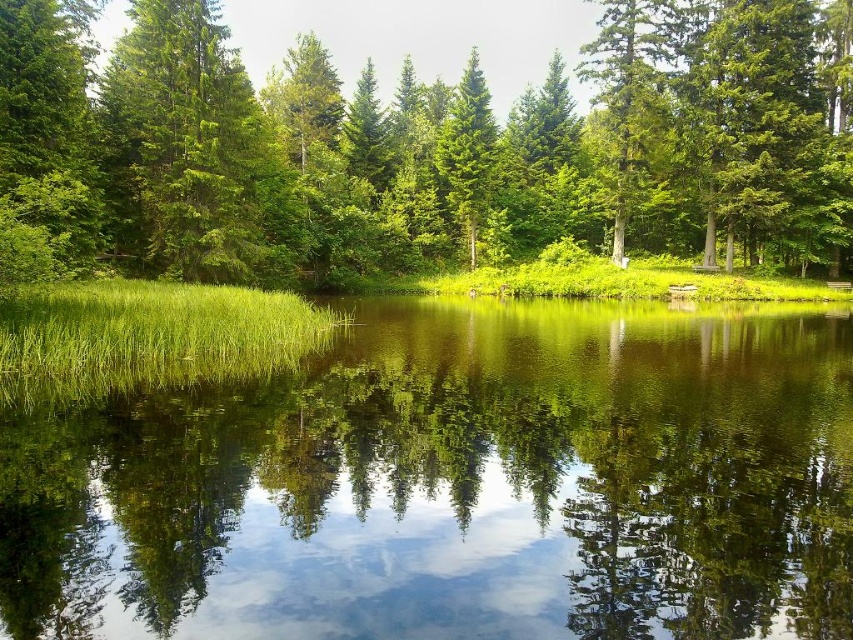
Identify the location of green grassy lake at center. Image resolution: width=853 pixels, height=640 pixels. [x=456, y=484].

Between green grassy lake at center and green matte tree at center, which one has less height?

With less height is green grassy lake at center.

Does point (267, 426) come closer to viewer compared to point (462, 170)?

Yes, it is in front of point (462, 170).

Find the location of a particular element. green grassy lake at center is located at coordinates (456, 484).

Is point (213, 22) behind point (467, 209)?

That is False.

Does green leafy tree at center appear on the left side of green matte tree at center?

Indeed, green leafy tree at center is positioned on the left side of green matte tree at center.

At what (x,y) coordinates should I click in order to perform the action: click on green leafy tree at center. Please return your answer as a coordinate pair (x, y). The height and width of the screenshot is (640, 853). Looking at the image, I should click on (421, 148).

Is the position of green leafy tree at center less distant than that of green matte tree at left?

Yes, green leafy tree at center is closer to the viewer.

Which is more to the right, green leafy tree at center or green matte tree at left?

green leafy tree at center is more to the right.

Who is more distant from viewer, (90, 88) or (257, 136)?

The point (257, 136) is behind.

This screenshot has height=640, width=853. I want to click on green leafy tree at center, so click(x=421, y=148).